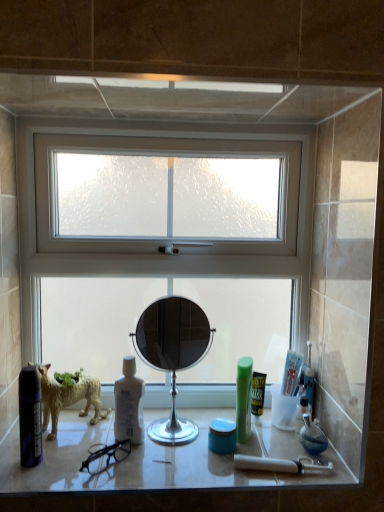
Question: Considering the relative sizes of green plastic mouthwash at right, the 1th mouthwash in the right-to-left sequence, and white frosted glass window at center in the image provided, is green plastic mouthwash at right, the 1th mouthwash in the right-to-left sequence, wider than white frosted glass window at center?

Choices:
 (A) no
 (B) yes

Answer: (A)

Question: Considering the relative positions of green plastic mouthwash at right, the 1th mouthwash in the right-to-left sequence, and white frosted glass window at center in the image provided, is green plastic mouthwash at right, the 1th mouthwash in the right-to-left sequence, to the left of white frosted glass window at center from the viewer's perspective?

Choices:
 (A) yes
 (B) no

Answer: (B)

Question: From the image's perspective, is green plastic mouthwash at right, the 1th mouthwash in the right-to-left sequence, located beneath white frosted glass window at center?

Choices:
 (A) yes
 (B) no

Answer: (A)

Question: From a real-world perspective, is green plastic mouthwash at right, the 3th mouthwash positioned from the left, physically below white frosted glass window at center?

Choices:
 (A) no
 (B) yes

Answer: (B)

Question: Could you tell me if green plastic mouthwash at right, the 3th mouthwash positioned from the left, is turned towards white frosted glass window at center?

Choices:
 (A) no
 (B) yes

Answer: (A)

Question: Visually, is green plastic bottle at center-right positioned to the left or to the right of white frosted glass window at center?

Choices:
 (A) right
 (B) left

Answer: (A)

Question: Looking at their shapes, would you say green plastic bottle at center-right is wider or thinner than white frosted glass window at center?

Choices:
 (A) thin
 (B) wide

Answer: (A)

Question: From the image's perspective, is green plastic bottle at center-right above or below white frosted glass window at center?

Choices:
 (A) above
 (B) below

Answer: (B)

Question: From a real-world perspective, is green plastic bottle at center-right above or below white frosted glass window at center?

Choices:
 (A) below
 (B) above

Answer: (A)

Question: Is green plastic mouthwash at right, the 3th mouthwash positioned from the left, inside or outside of white frosted glass window at center?

Choices:
 (A) inside
 (B) outside

Answer: (B)

Question: From the image's perspective, is green plastic mouthwash at right, the 1th mouthwash in the right-to-left sequence, above or below white frosted glass window at center?

Choices:
 (A) above
 (B) below

Answer: (B)

Question: Is green plastic mouthwash at right, the 3th mouthwash positioned from the left, in front of or behind white frosted glass window at center in the image?

Choices:
 (A) behind
 (B) front

Answer: (A)

Question: Visually, is green plastic mouthwash at right, the 3th mouthwash positioned from the left, positioned to the left or to the right of white frosted glass window at center?

Choices:
 (A) left
 (B) right

Answer: (B)

Question: From a real-world perspective, is matte black can at left physically located above or below green plastic bottle at center-right?

Choices:
 (A) above
 (B) below

Answer: (A)

Question: Is matte black can at left in front of or behind green plastic bottle at center-right in the image?

Choices:
 (A) behind
 (B) front

Answer: (B)